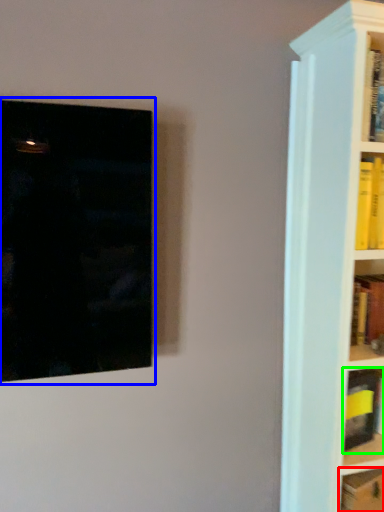
Question: Which object is positioned farthest from book (highlighted by a red box)? Select from picture frame (highlighted by a blue box) and book (highlighted by a green box).

Choices:
 (A) picture frame
 (B) book

Answer: (A)